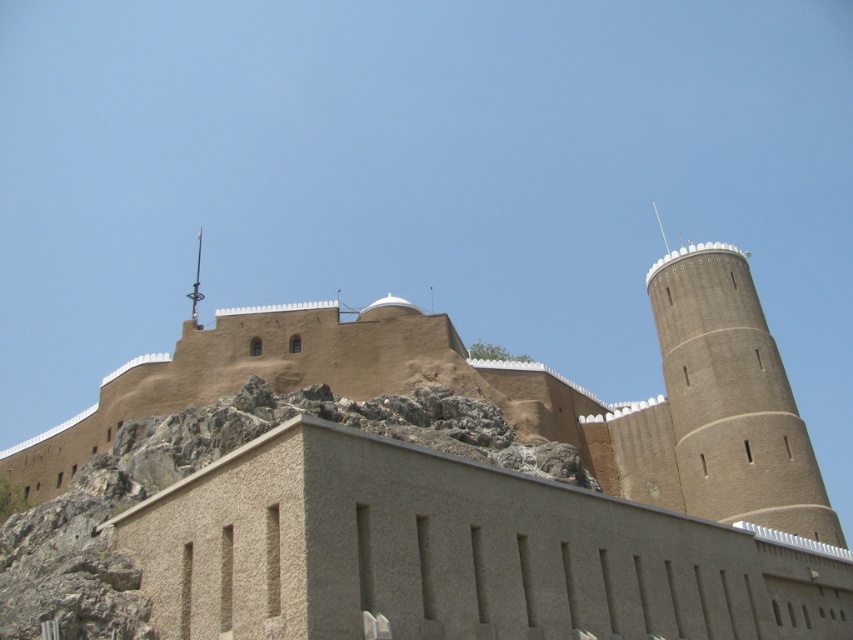
You are a soldier positioned at the base of the brown textured castle at center and need to reach the brown textured tower at right. Which direction should you move to get closer to the tower?

The brown textured castle at center is in front of the brown textured tower at right, so moving backward away from the castle would bring you closer to the tower.

You are a historian examining the fortification. Based on the image, which structure, the brown textured castle at center or the brown textured tower at right, is taller?

The brown textured castle at center is taller than the brown textured tower at right.

You are a drone operator tasked with capturing aerial footage of the historic fortification. The drone must fly from the cylindrical tower on the right to the brown textured castle at center. Based on the coordinates provided, in which direction should the drone move horizontally to reach the castle?

The brown textured castle at center is located at coordinates point (432, 486). Since the cylindrical tower is on the right side of the image, the drone should move to the left horizontally to reach the castle.